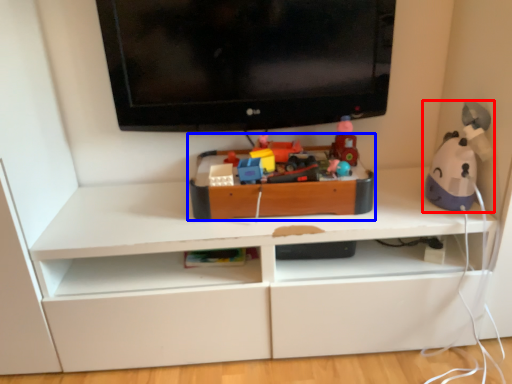
Question: Which object appears closest to the camera in this image, toy (highlighted by a red box) or toy (highlighted by a blue box)?

Choices:
 (A) toy
 (B) toy

Answer: (A)